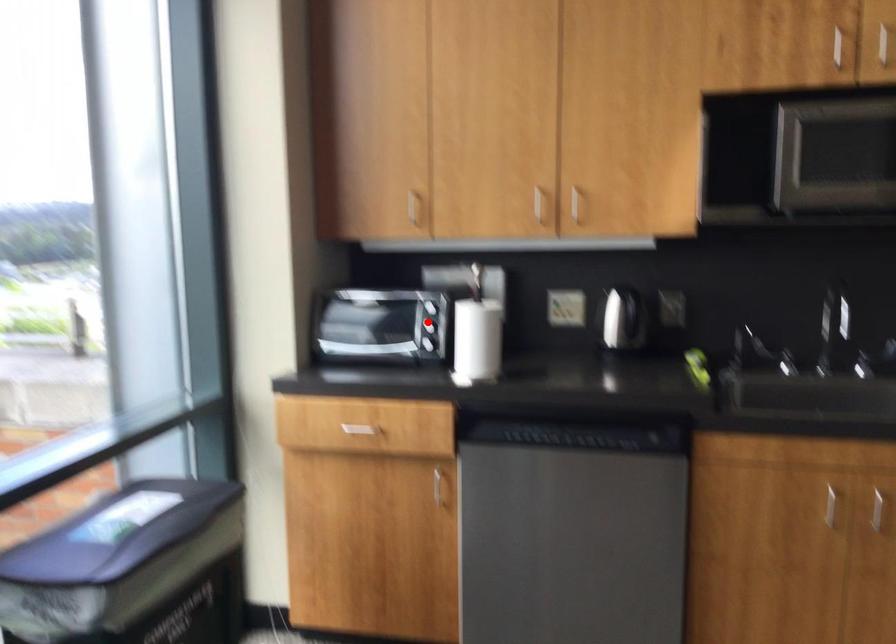
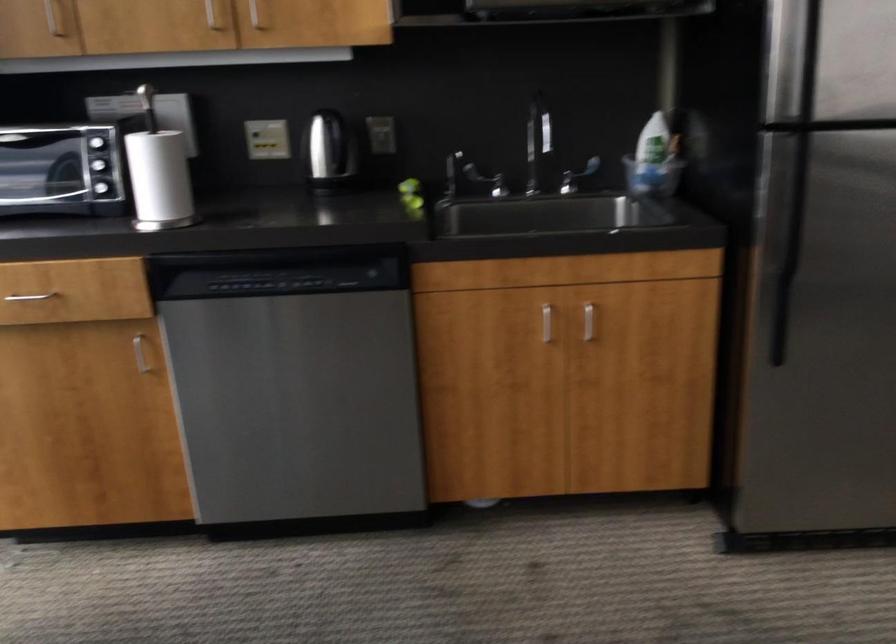
Locate, in the second image, the point that corresponds to the highlighted location in the first image.

(99, 162)